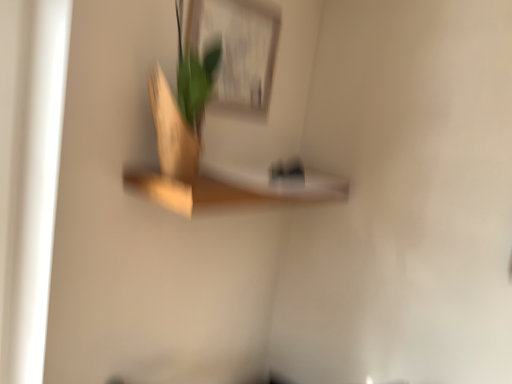
Question: In terms of size, does matte white picture frame at upper center appear bigger or smaller than wooden shelf at center?

Choices:
 (A) small
 (B) big

Answer: (A)

Question: From a real-world perspective, is matte white picture frame at upper center above or below wooden shelf at center?

Choices:
 (A) below
 (B) above

Answer: (B)

Question: Is matte white picture frame at upper center taller or shorter than wooden shelf at center?

Choices:
 (A) tall
 (B) short

Answer: (A)

Question: From the image's perspective, is wooden shelf at center positioned above or below matte white picture frame at upper center?

Choices:
 (A) above
 (B) below

Answer: (B)

Question: In terms of width, does wooden shelf at center look wider or thinner when compared to matte white picture frame at upper center?

Choices:
 (A) thin
 (B) wide

Answer: (B)

Question: Relative to matte white picture frame at upper center, is wooden shelf at center in front or behind?

Choices:
 (A) behind
 (B) front

Answer: (B)

Question: In terms of height, does wooden shelf at center look taller or shorter compared to matte white picture frame at upper center?

Choices:
 (A) tall
 (B) short

Answer: (B)